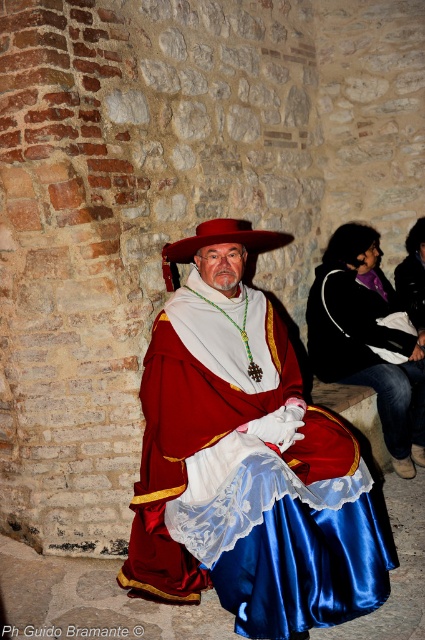
Does white satin robe at center have a greater height compared to matte red hat at center?

Correct, white satin robe at center is much taller as matte red hat at center.

Consider the image. Is white satin robe at center positioned before matte red hat at center?

No, white satin robe at center is further to the viewer.

Locate an element on the screen. This screenshot has width=425, height=640. white satin robe at center is located at coordinates (365, 353).

Where is `white satin robe at center`? The image size is (425, 640). white satin robe at center is located at coordinates (365, 353).

Who is lower down, satin dress at center or matte red hat at center?

satin dress at center is below.

Between satin dress at center and matte red hat at center, which one has more height?

With more height is satin dress at center.

You are a GUI agent. You are given a task and a screenshot of the screen. Output one action in this format:
    pyautogui.click(x=<x>, y=<y>)
    Task: Click on the satin dress at center
    
    Given the screenshot: What is the action you would take?
    pyautogui.click(x=246, y=461)

At what (x,y) coordinates should I click in order to perform the action: click on satin dress at center. Please return your answer as a coordinate pair (x, y). The image size is (425, 640). Looking at the image, I should click on (246, 461).

Who is more forward, (343,492) or (408,428)?

Point (343,492)

This screenshot has width=425, height=640. Find the location of `satin dress at center`. satin dress at center is located at coordinates (246, 461).